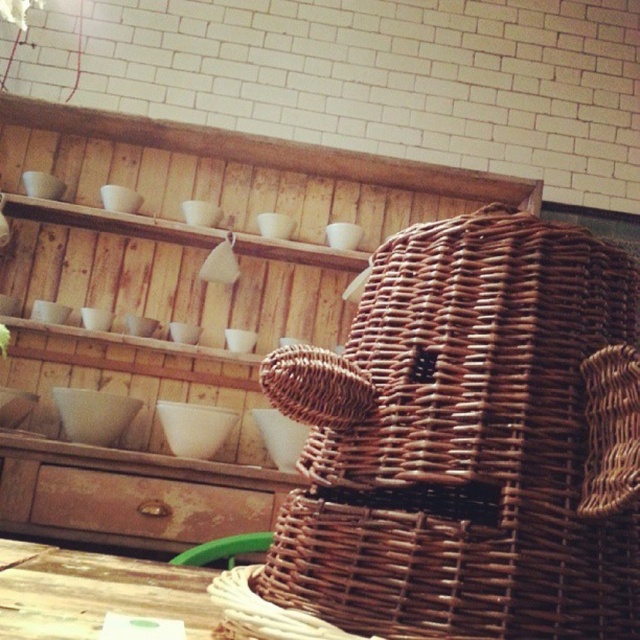
Question: Which object appears closest to the camera in this image?

Choices:
 (A) rusty wood drawer at lower left
 (B) wooden table at lower left
 (C) brown wicker basket at center

Answer: (C)

Question: Is brown wicker basket at center bigger than rusty wood drawer at lower left?

Choices:
 (A) no
 (B) yes

Answer: (B)

Question: Which object is farther from the camera taking this photo?

Choices:
 (A) wooden table at lower left
 (B) rusty wood drawer at lower left

Answer: (B)

Question: Is brown wicker basket at center above rusty wood drawer at lower left?

Choices:
 (A) no
 (B) yes

Answer: (B)

Question: Can you confirm if wooden table at lower left is smaller than rusty wood drawer at lower left?

Choices:
 (A) no
 (B) yes

Answer: (A)

Question: Which point is closer to the camera?

Choices:
 (A) wooden table at lower left
 (B) brown wicker basket at center

Answer: (B)